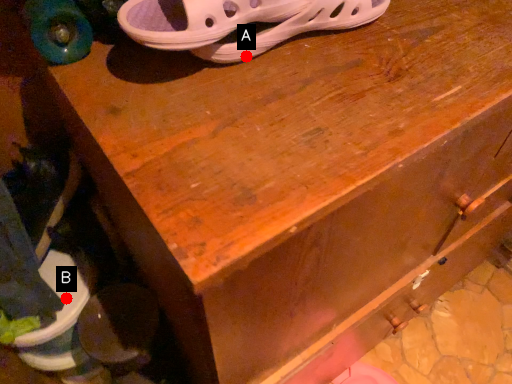
Question: Two points are circled on the image, labeled by A and B beside each circle. Among these points, which one is nearest to the camera?

Choices:
 (A) A is closer
 (B) B is closer

Answer: (A)